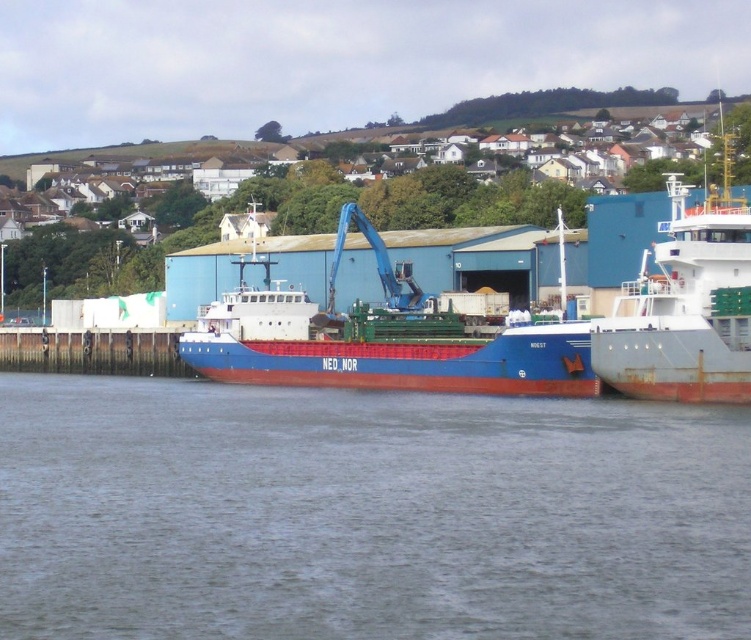
You are standing on the deck of the NED_NOR cargo ship and looking towards the industrial buildings in the background. There is a point marked at coordinates (x=365, y=513). What is located at that point?

The point at coordinates (x=365, y=513) indicates gray water at center.